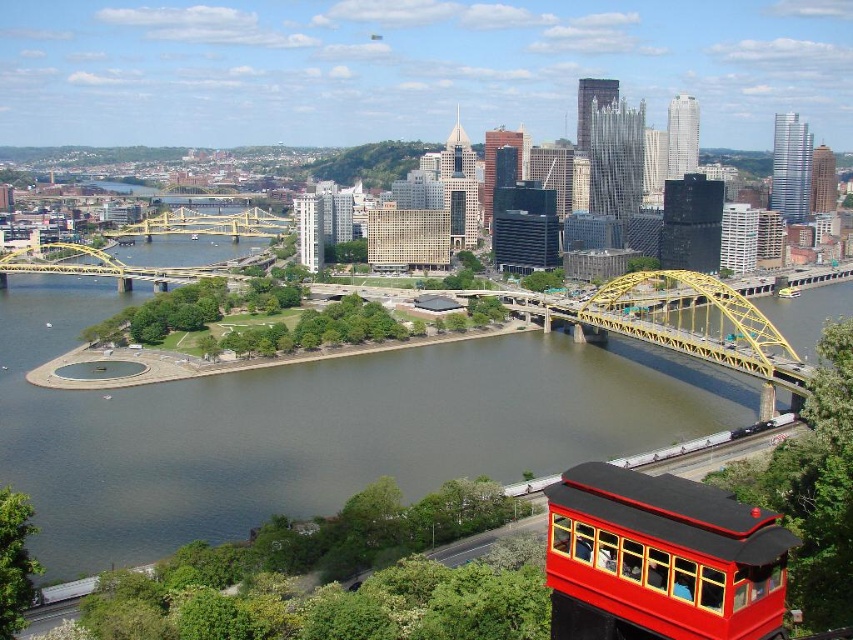
You are standing at the edge of the river in the city scene and want to take a photo of the shiny red trolley car at lower right. Since the brown water at center is much taller than the trolley car, will the water appear larger in the photo?

Yes, the brown water at center will appear larger in the photo than the shiny red trolley car at lower right because it is much taller as described.

You are standing at the red structure with passengers visible through its windows in the foreground. If you want to reach the green park area with trees and a circular fountain across the river, which direction should you head relative to the brown water at center?

The brown water at center is located at point (312, 428). To reach the green park area across the river, you should head to the side opposite the brown water at center since the park is on one side of the river and the buildings are on the other. However, without specific coordinate directions, the safest answer is to go across the brown water at center towards the green park area.